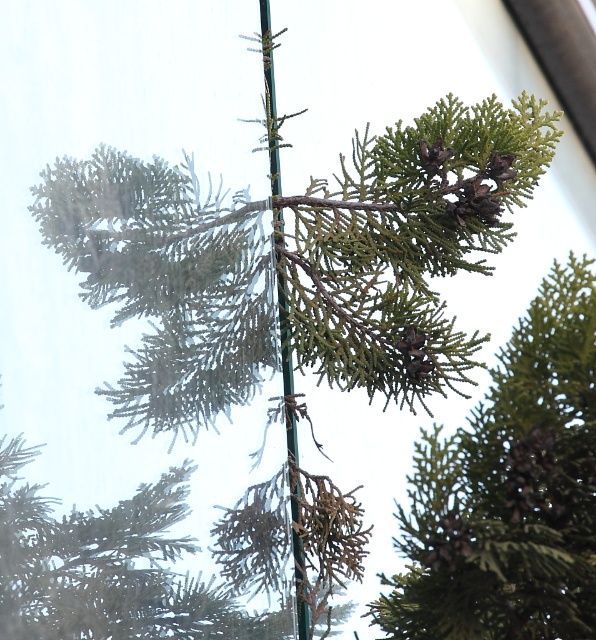
What object is located at the coordinates point (510, 492) in the image?

The point (510, 492) indicates the location of the green matte pine cone at center.

You are a gardener inspecting a greenhouse. You notice a green matte pine cone at center and a green metallic pole at center. Which object is closer to you?

The green matte pine cone at center is closer because it is in front of the green metallic pole at center.

You are a gardener inspecting a greenhouse. You notice a green matte pine cone at center and a green metallic pole at center. Which object is positioned to the right side of the other?

The green matte pine cone at center is to the right of the green metallic pole at center.